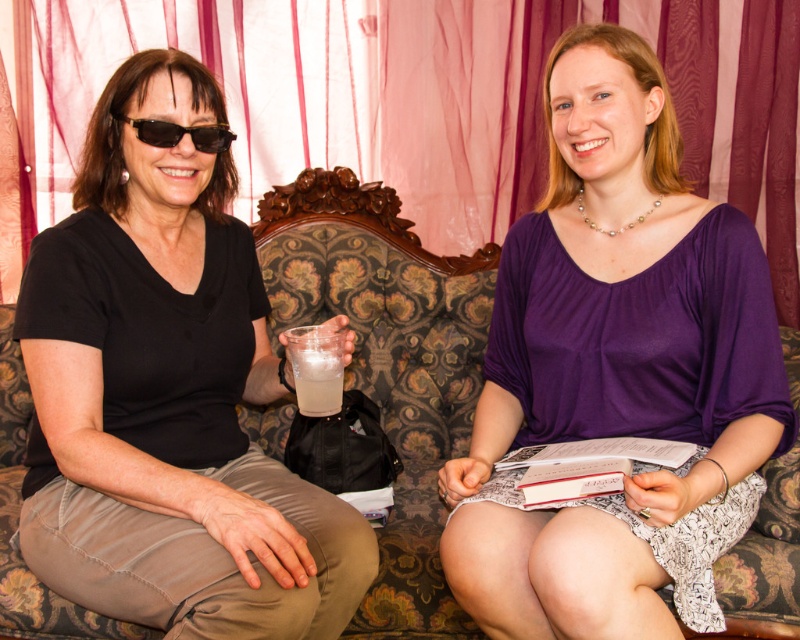
You are a fashion designer observing the image. You need to determine if the purple satin dress at center can be placed on the patterned fabric couch at center without slipping. What spatial relationship between them should you consider?

The purple satin dress at center is above patterned fabric couch at center, so it is already positioned on top of the couch. Therefore, there is no slipping issue as it is already placed there.

You are a fashion designer observing the scene. You need to determine the spatial relationship between the black matte shirt at left and the black plastic sunglasses at left. Which one is located lower in the image?

The black matte shirt at left is positioned under the black plastic sunglasses at left, so the shirt is lower than the sunglasses.